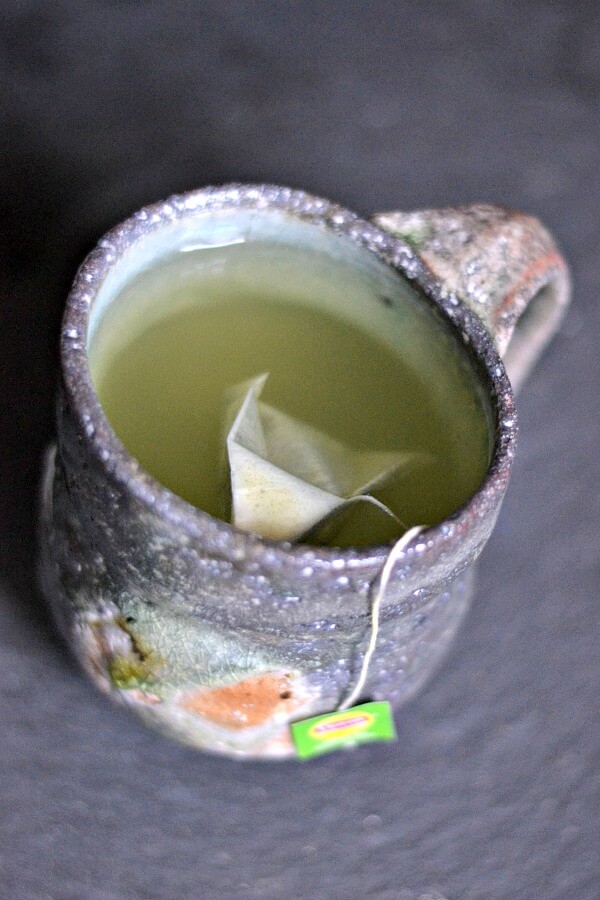
The width and height of the screenshot is (600, 900). In order to click on mug in this screenshot , I will do `click(255, 623)`.